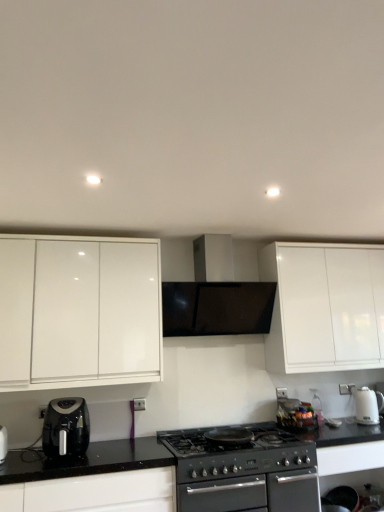
Question: Relative to black plastic air fryer at lower left, positioned as the second kitchen appliance in right-to-left order, is black matte stove at center in front or behind?

Choices:
 (A) behind
 (B) front

Answer: (B)

Question: Is black matte stove at center bigger or smaller than black plastic air fryer at lower left, positioned as the second kitchen appliance in right-to-left order?

Choices:
 (A) big
 (B) small

Answer: (A)

Question: Based on their relative distances, which object is farther from the white glossy electric kettle at right, which ranks as the first kitchen appliance in back-to-front order?

Choices:
 (A) black plastic air fryer at lower left, marked as the first kitchen appliance in a front-to-back arrangement
 (B) black matte range hood at center
 (C) white glossy cabinet at left
 (D) black matte stove at center
 (E) black granite countertop at lower left

Answer: (C)

Question: Which object is positioned closest to the black matte range hood at center?

Choices:
 (A) white glossy electric kettle at right, the second kitchen appliance viewed from the front
 (B) black granite countertop at lower left
 (C) white glossy cabinet at left
 (D) black matte stove at center
 (E) black plastic air fryer at lower left, positioned as the second kitchen appliance in right-to-left order

Answer: (C)